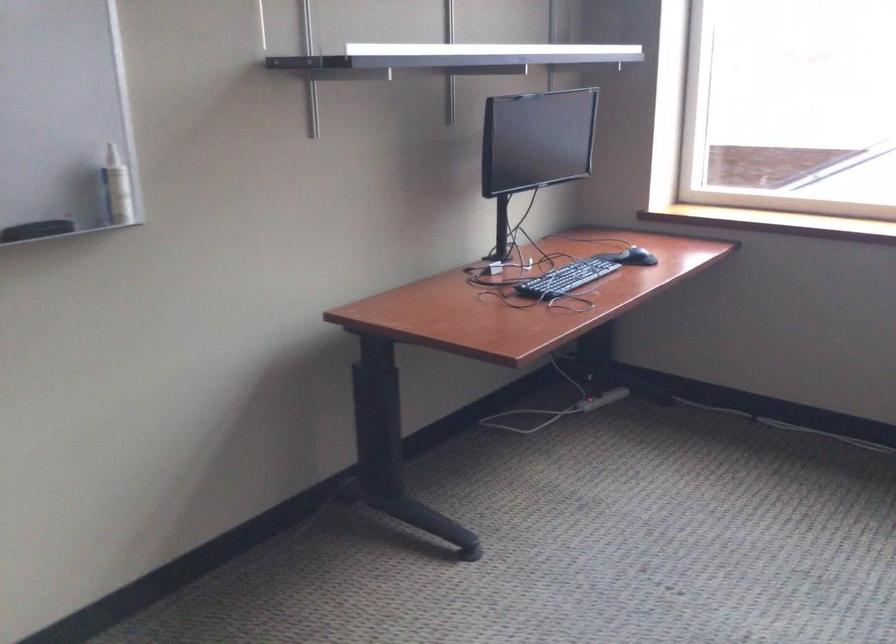
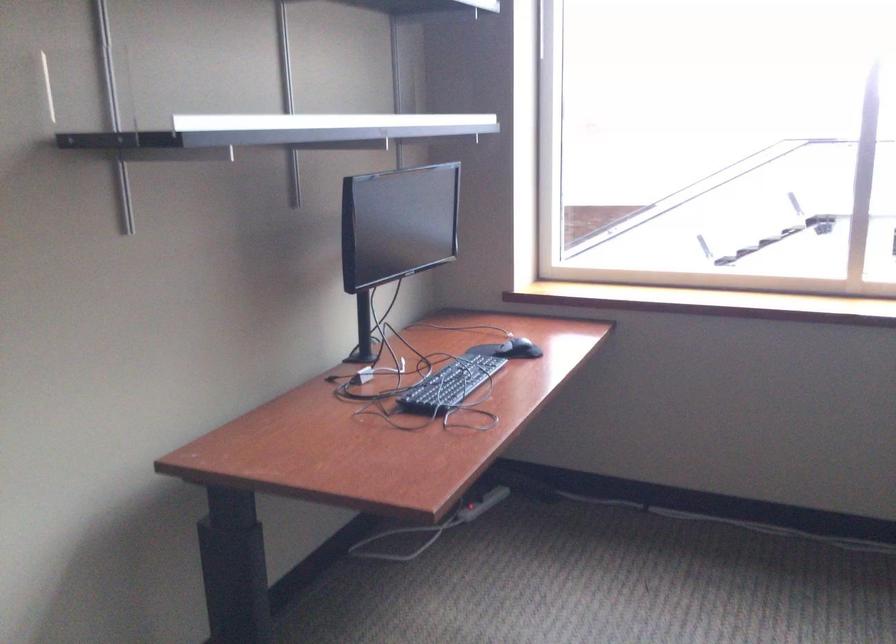
Which direction would the cameraman need to move to produce the second image?

The cameraman walked toward left, forward.